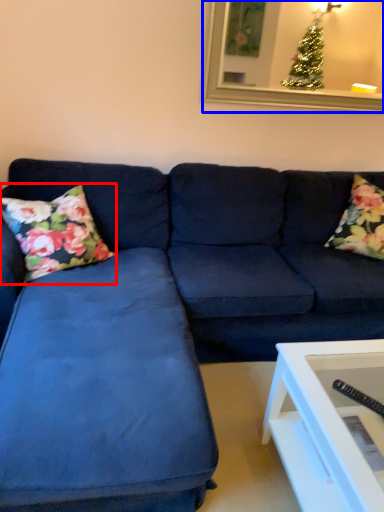
Question: Which object appears farthest to the camera in this image, pillow (highlighted by a red box) or picture frame (highlighted by a blue box)?

Choices:
 (A) pillow
 (B) picture frame

Answer: (B)